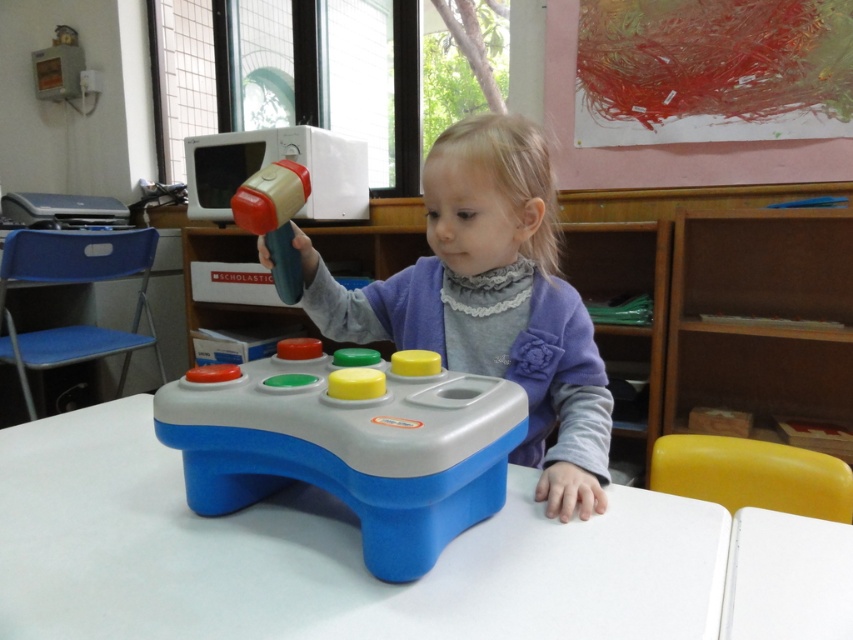
Question: Where is blue plastic table at center located in relation to matte plastic toddler at center in the image?

Choices:
 (A) left
 (B) right

Answer: (A)

Question: Which object appears farthest from the camera in this image?

Choices:
 (A) matte plastic toddler at center
 (B) rubberized plastic hammer at upper center
 (C) blue plastic table at center

Answer: (B)

Question: Does blue plastic gamepad at center have a smaller size compared to matte plastic toddler at center?

Choices:
 (A) no
 (B) yes

Answer: (B)

Question: Among these points, which one is nearest to the camera?

Choices:
 (A) (267, 397)
 (B) (306, 182)
 (C) (651, 618)

Answer: (C)

Question: Among these points, which one is nearest to the camera?

Choices:
 (A) pyautogui.click(x=509, y=403)
 (B) pyautogui.click(x=265, y=168)
 (C) pyautogui.click(x=119, y=497)
 (D) pyautogui.click(x=517, y=168)

Answer: (A)

Question: Can you confirm if blue plastic gamepad at center is smaller than matte plastic toddler at center?

Choices:
 (A) no
 (B) yes

Answer: (B)